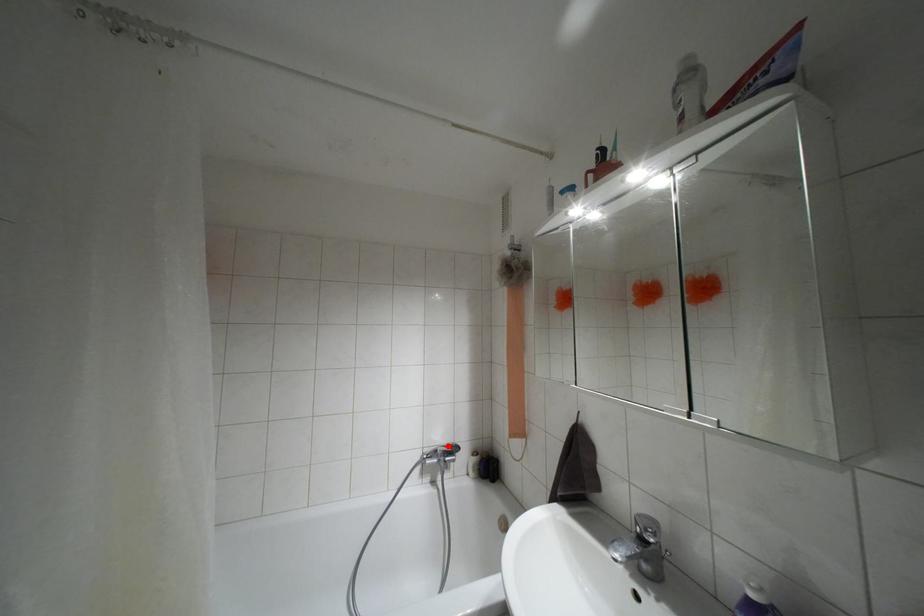
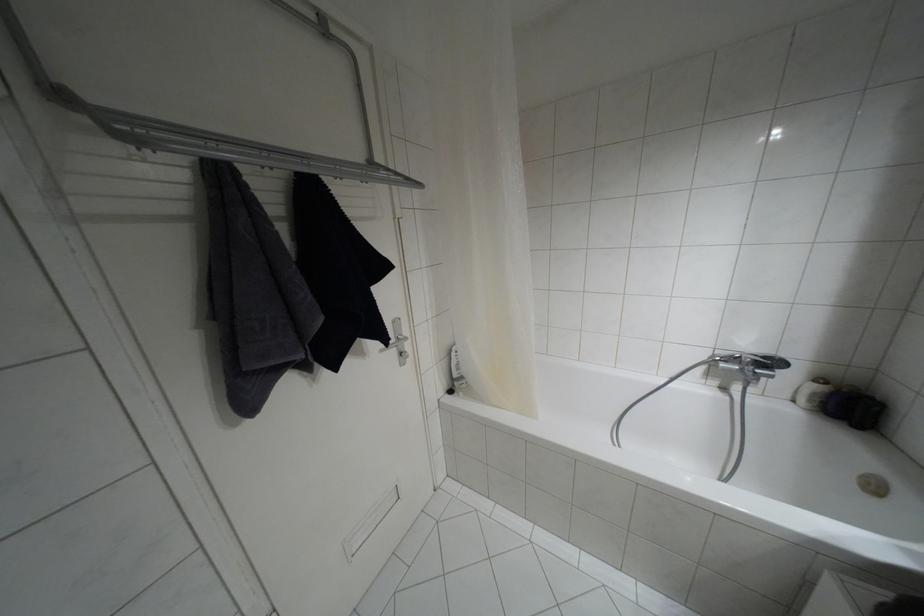
Question: I am providing you with two images of the same scene from different viewpoints. In image1, a red point is highlighted. Considering the same 3D point in image2, which of the following is correct?

Choices:
 (A) It is closer
 (B) It is farther

Answer: (A)